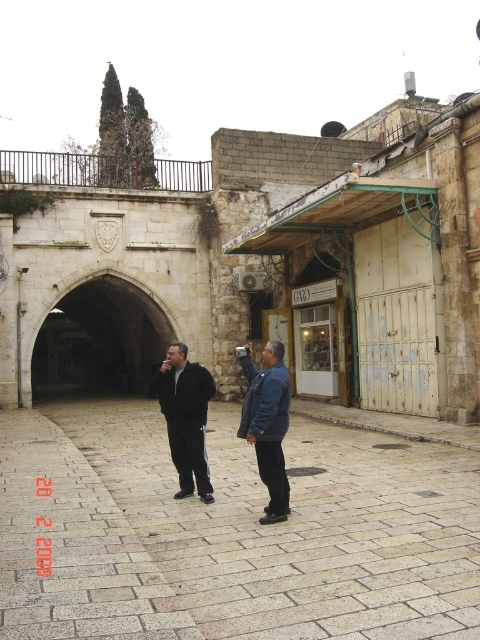
You are standing in the middle of the smooth stone alley at center. Looking around, you see an arched entrance on the left side. In which direction should you walk to exit the alley towards the arched entrance?

You should walk towards the left side to exit the alley towards the arched entrance.

You are a tourist in this historical area and want to take a photo of the smooth stone alley at center without the blue denim jacket at center blocking the view. Is the alley shorter than the jacket, making it possible for you to step back and frame the shot without the jacket in the way?

The smooth stone alley at center has a lesser height compared to the blue denim jacket at center, meaning the alley is shorter. By stepping back, you can frame the shot so the jacket is below the alley in the frame, avoiding obstruction.